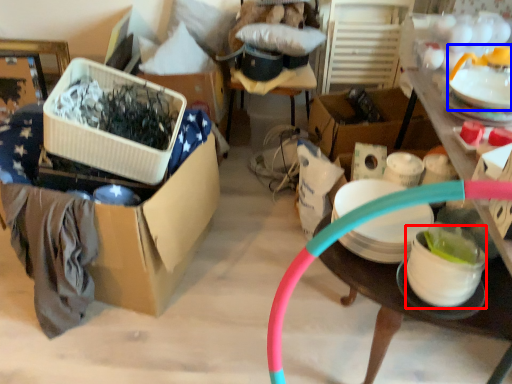
Question: Which of the following is the closest to the observer, tableware (highlighted by a red box) or tableware (highlighted by a blue box)?

Choices:
 (A) tableware
 (B) tableware

Answer: (A)